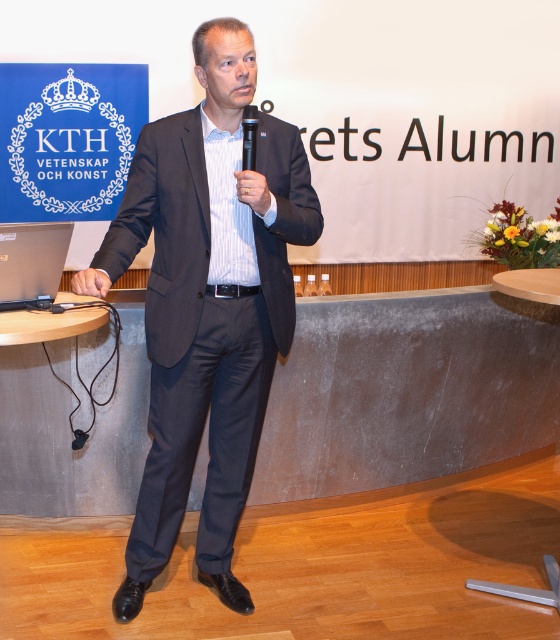
Is point (164, 412) closer to viewer compared to point (254, 145)?

That is False.

Between dark gray suit at center and black plastic microphone at center, which one is positioned lower?

dark gray suit at center

Which is in front, point (226, 451) or point (252, 115)?

Positioned in front is point (252, 115).

Identify the location of dark gray suit at center. Image resolution: width=560 pixels, height=640 pixels. (207, 305).

Can you confirm if silver metallic laptop at lower left is positioned below black plastic microphone at center?

Correct, silver metallic laptop at lower left is located below black plastic microphone at center.

Is silver metallic laptop at lower left taller than black plastic microphone at center?

Yes.

Is point (63, 253) behind point (245, 168)?

Yes, point (63, 253) is farther from viewer.

The image size is (560, 640). What are the coordinates of `silver metallic laptop at lower left` in the screenshot? It's located at pyautogui.click(x=31, y=262).

Which is more to the left, dark gray suit at center or silver metallic laptop at lower left?

silver metallic laptop at lower left is more to the left.

The height and width of the screenshot is (640, 560). I want to click on dark gray suit at center, so click(x=207, y=305).

This screenshot has height=640, width=560. What are the coordinates of `dark gray suit at center` in the screenshot? It's located at (207, 305).